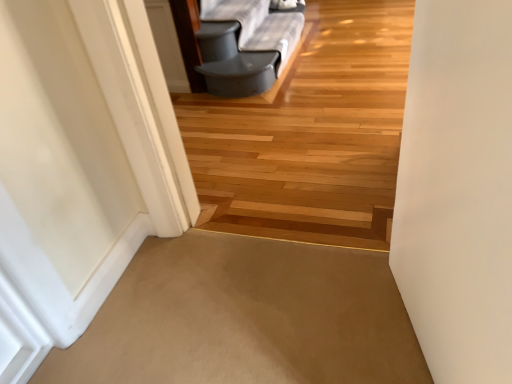
Question: Is beige carpet at center, the 2th path viewed from the top, not inside wooden floor at center, the first path from the top?

Choices:
 (A) yes
 (B) no

Answer: (A)

Question: From the image's perspective, is beige carpet at center, the 2th path viewed from the top, on wooden floor at center, the 2th path when ordered from bottom to top?

Choices:
 (A) yes
 (B) no

Answer: (B)

Question: Can you confirm if beige carpet at center, the 2th path viewed from the top, is shorter than wooden floor at center, the first path from the top?

Choices:
 (A) yes
 (B) no

Answer: (A)

Question: From the image's perspective, is beige carpet at center, the 2th path viewed from the top, beneath wooden floor at center, the 2th path when ordered from bottom to top?

Choices:
 (A) no
 (B) yes

Answer: (B)

Question: From a real-world perspective, is beige carpet at center, the 2th path viewed from the top, physically below wooden floor at center, the 2th path when ordered from bottom to top?

Choices:
 (A) yes
 (B) no

Answer: (A)

Question: Can you confirm if beige carpet at center, the 2th path viewed from the top, is positioned to the left of wooden floor at center, the 2th path when ordered from bottom to top?

Choices:
 (A) yes
 (B) no

Answer: (A)

Question: Is beige carpet at center, the 2th path viewed from the top, inside wooden floor at center, the first path from the top?

Choices:
 (A) no
 (B) yes

Answer: (A)

Question: Is wooden floor at center, the 2th path when ordered from bottom to top, placed right next to beige carpet at center, the 2th path viewed from the top?

Choices:
 (A) yes
 (B) no

Answer: (B)

Question: Considering the relative positions of wooden floor at center, the 2th path when ordered from bottom to top, and beige carpet at center, the 2th path viewed from the top, in the image provided, is wooden floor at center, the 2th path when ordered from bottom to top, in front of beige carpet at center, the 2th path viewed from the top,?

Choices:
 (A) yes
 (B) no

Answer: (A)

Question: Considering the relative sizes of wooden floor at center, the first path from the top, and beige carpet at center, the 1th path ordered from the bottom, in the image provided, is wooden floor at center, the first path from the top, taller than beige carpet at center, the 1th path ordered from the bottom,?

Choices:
 (A) no
 (B) yes

Answer: (B)

Question: Does wooden floor at center, the 2th path when ordered from bottom to top, appear on the left side of beige carpet at center, the 2th path viewed from the top?

Choices:
 (A) no
 (B) yes

Answer: (A)

Question: Is the position of wooden floor at center, the 2th path when ordered from bottom to top, more distant than that of beige carpet at center, the 2th path viewed from the top?

Choices:
 (A) yes
 (B) no

Answer: (B)

Question: From the image's perspective, relative to wooden floor at center, the first path from the top, is beige carpet at center, the 2th path viewed from the top, above or below?

Choices:
 (A) below
 (B) above

Answer: (A)